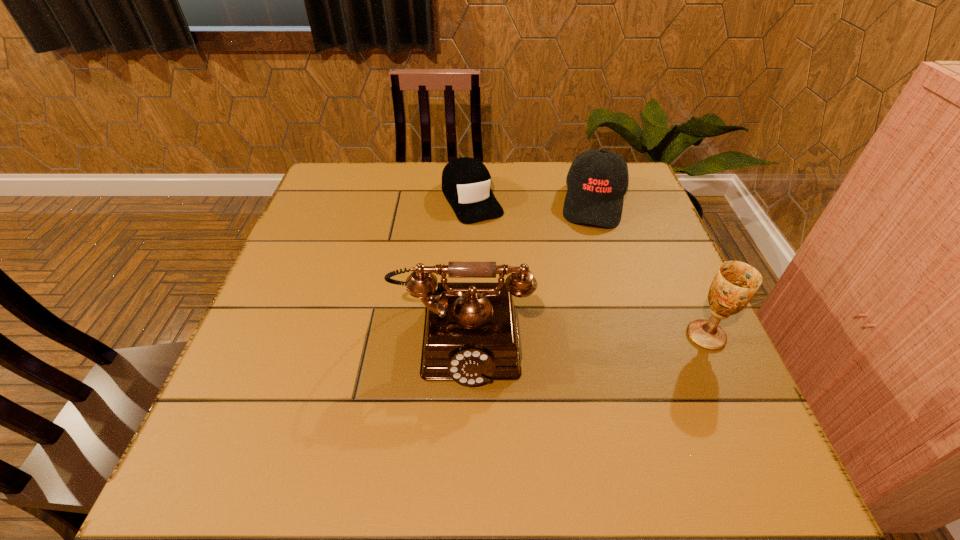
You are a GUI agent. You are given a task and a screenshot of the screen. Output one action in this format:
    pyautogui.click(x=<x>, y=<y>)
    Task: Click on the free space on the desktop that is between the telephone and the third shortest object and is positioned on the front-facing side of the shortest object
    The image size is (960, 540).
    Given the screenshot: What is the action you would take?
    pyautogui.click(x=556, y=335)

Locate an element on the screen. vacant space on the desktop that is between the telephone and the second tallest object and is positioned on the front-facing side of the baseball cap is located at coordinates (580, 335).